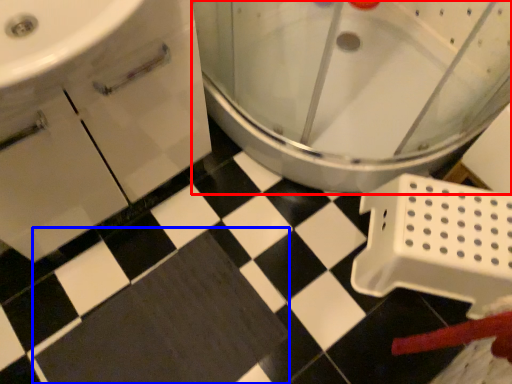
Question: Which object is closer to the camera taking this photo, toilet (highlighted by a red box) or bath mat (highlighted by a blue box)?

Choices:
 (A) toilet
 (B) bath mat

Answer: (A)